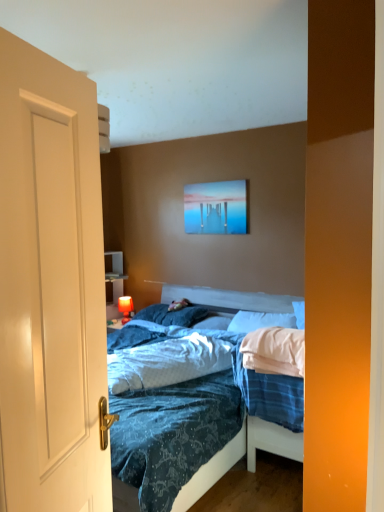
Question: Is blue textured fabric at center positioned before pillow at center, arranged as the first pillow when viewed from the right?

Choices:
 (A) yes
 (B) no

Answer: (A)

Question: Considering the relative sizes of blue textured fabric at center and pillow at center, arranged as the first pillow when viewed from the right, in the image provided, is blue textured fabric at center smaller than pillow at center, arranged as the first pillow when viewed from the right,?

Choices:
 (A) yes
 (B) no

Answer: (B)

Question: From the image's perspective, is blue textured fabric at center beneath pillow at center, marked as the third pillow in a left-to-right arrangement?

Choices:
 (A) no
 (B) yes

Answer: (B)

Question: Does blue textured fabric at center have a greater width compared to pillow at center, marked as the third pillow in a left-to-right arrangement?

Choices:
 (A) yes
 (B) no

Answer: (A)

Question: Is blue textured fabric at center positioned with its back to pillow at center, marked as the third pillow in a left-to-right arrangement?

Choices:
 (A) yes
 (B) no

Answer: (A)

Question: From the image's perspective, is white matte door at left above or below blue textured fabric at center?

Choices:
 (A) below
 (B) above

Answer: (B)

Question: Would you say white matte door at left is inside or outside blue textured fabric at center?

Choices:
 (A) outside
 (B) inside

Answer: (A)

Question: In terms of size, does white matte door at left appear bigger or smaller than blue textured fabric at center?

Choices:
 (A) big
 (B) small

Answer: (B)

Question: In the image, is white matte door at left on the left side or the right side of blue textured fabric at center?

Choices:
 (A) left
 (B) right

Answer: (A)

Question: In the image, is blue soft pillow at center, positioned as the 1th pillow in left-to-right order, positioned in front of or behind white matte door at left?

Choices:
 (A) behind
 (B) front

Answer: (A)

Question: In the image, is blue soft pillow at center, positioned as the 1th pillow in left-to-right order, on the left side or the right side of white matte door at left?

Choices:
 (A) left
 (B) right

Answer: (B)

Question: In terms of height, does blue soft pillow at center, positioned as the 1th pillow in left-to-right order, look taller or shorter compared to white matte door at left?

Choices:
 (A) short
 (B) tall

Answer: (A)

Question: Does point pyautogui.click(x=180, y=320) appear closer or farther from the camera than point pyautogui.click(x=89, y=362)?

Choices:
 (A) closer
 (B) farther

Answer: (B)

Question: From the image's perspective, is pillow at center, arranged as the first pillow when viewed from the right, above or below white matte door at left?

Choices:
 (A) below
 (B) above

Answer: (A)

Question: Is point (276, 325) positioned closer to the camera than point (61, 200)?

Choices:
 (A) farther
 (B) closer

Answer: (A)